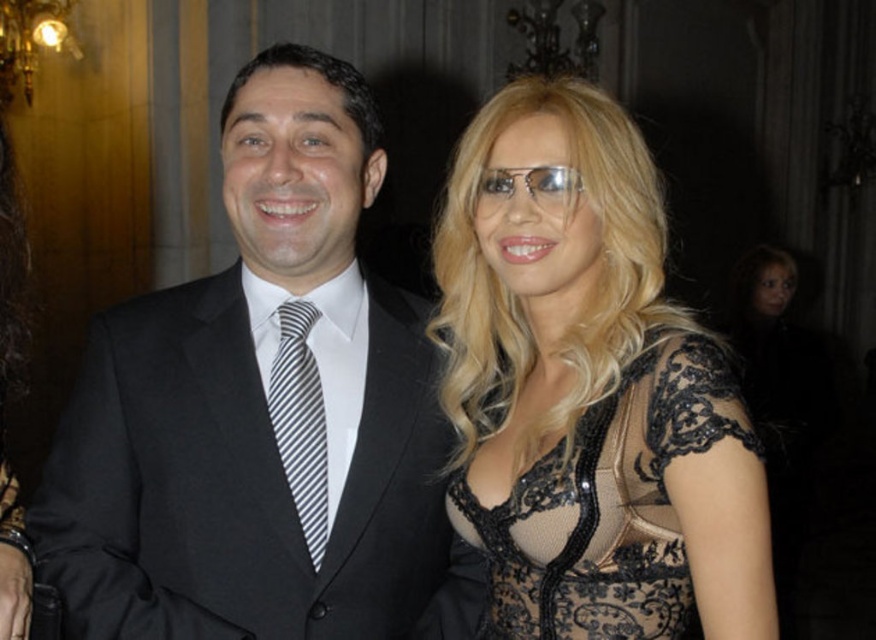
You are a photographer at a formal event. You need to position two subjects wearing the black satin suit at center and the black lace dress at center so that the dress is to the right of the suit. Is the current arrangement correct?

The black satin suit at center is currently to the left of the black lace dress at center, so the dress is already positioned to the right of the suit. The current arrangement is correct.

You are a photographer at a formal event. You need to capture a clear photo of the black satin suit at center without the striped fabric tie at center overlapping it. Based on their positions, can you do this?

The black satin suit at center is in front of the striped fabric tie at center, so yes, the photographer can capture a clear photo of the black satin suit at center without the striped fabric tie at center overlapping it since it is already positioned behind.